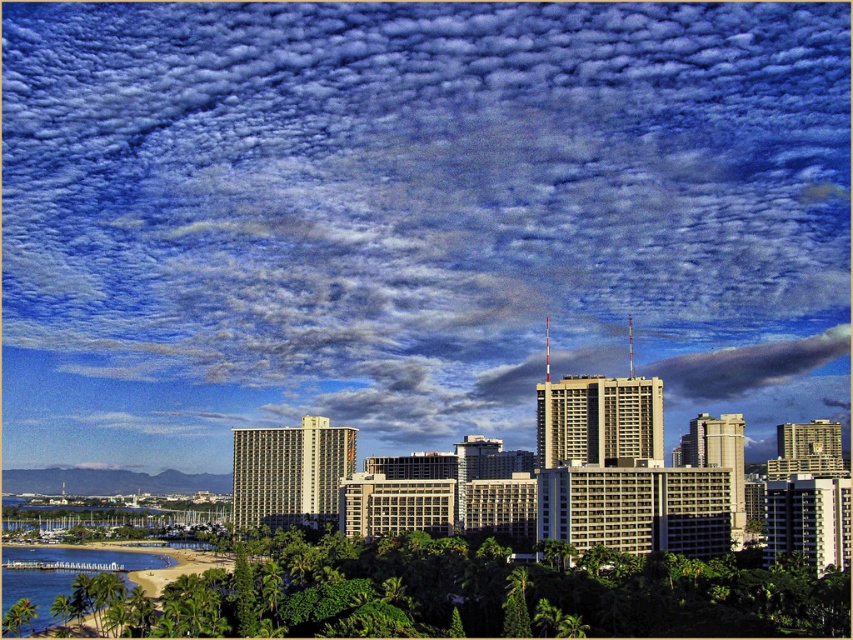
Does cloudy sky at upper center have a greater width compared to clear blue water at lower left?

Yes, cloudy sky at upper center is wider than clear blue water at lower left.

Can you confirm if cloudy sky at upper center is positioned to the right of clear blue water at lower left?

Yes, cloudy sky at upper center is to the right of clear blue water at lower left.

Which is in front, point (527, 150) or point (36, 598)?

Point (36, 598)

Find the location of `cloudy sky at upper center`. cloudy sky at upper center is located at coordinates (428, 200).

Is point (695, 381) in front of point (38, 582)?

No, (695, 381) is further to viewer.

Find the location of a particular element. gray/cloudy sky at center is located at coordinates (746, 365).

Does point (570, 365) come behind point (90, 561)?

Yes, it is behind point (90, 561).

Find the location of `gray/cloudy sky at center`. gray/cloudy sky at center is located at coordinates (746, 365).

Does cloudy sky at upper center appear on the right side of gray/cloudy sky at center?

In fact, cloudy sky at upper center is to the left of gray/cloudy sky at center.

Does cloudy sky at upper center appear over gray/cloudy sky at center?

Indeed, cloudy sky at upper center is positioned over gray/cloudy sky at center.

Which is in front, point (405, 218) or point (822, 337)?

Positioned in front is point (405, 218).

Image resolution: width=853 pixels, height=640 pixels. In order to click on cloudy sky at upper center in this screenshot , I will do `click(428, 200)`.